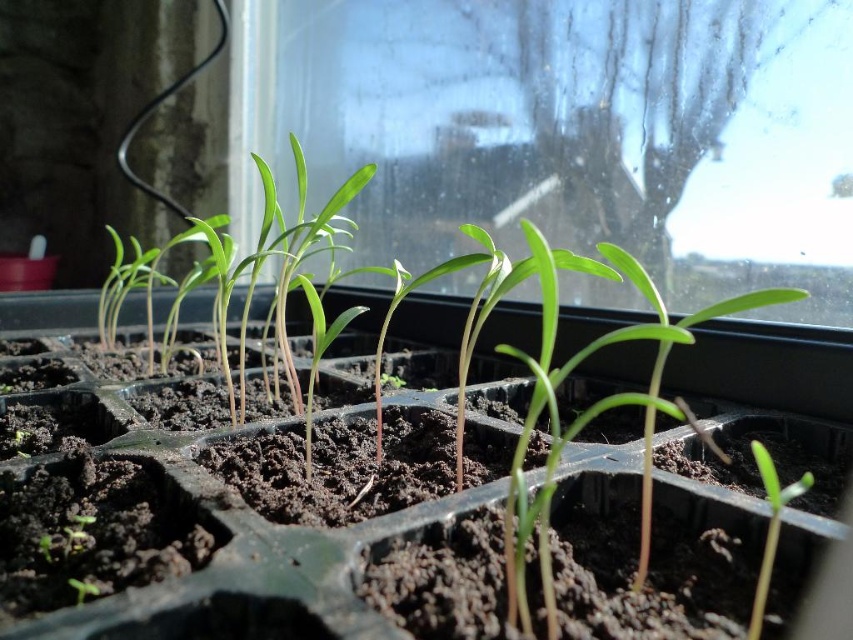
You are a gardener who wants to place a small decorative stone between the green plastic tray at center and the green matte seedling at lower right. Since both objects are green, you need to ensure the stone won

The green plastic tray at center is wider than the green matte seedling at lower right, so the stone should be placed closer to the seedling to balance the space between them.

You are a gardener who wants to ensure the green matte seedling at lower right receives enough light. Given that the transparent glass window at center is the only light source in the scene, can you determine if the seedling is positioned to receive direct sunlight from the window?

The transparent glass window at center is taller than the green matte seedling at lower right, so the seedling is positioned to receive direct sunlight from the window since the window is taller and likely provides sufficient light coverage.

You are a gardener who needs to reach the green plastic tray at center to water the seedlings. Considering your arm can extend 24 inches, will you be able to reach the tray without moving closer?

The green plastic tray at center is 22.13 inches away from the viewer. Since your arm can extend 24 inches, you can reach the tray without moving closer.